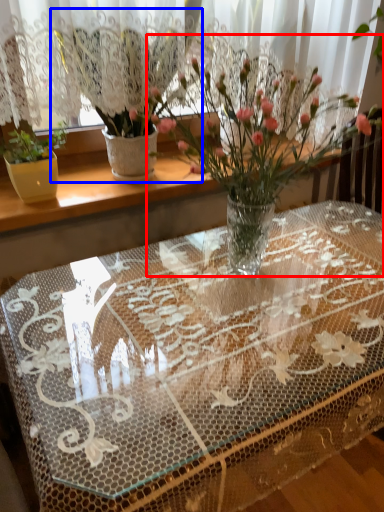
Question: Which point is closer to the camera, houseplant (highlighted by a red box) or houseplant (highlighted by a blue box)?

Choices:
 (A) houseplant
 (B) houseplant

Answer: (A)